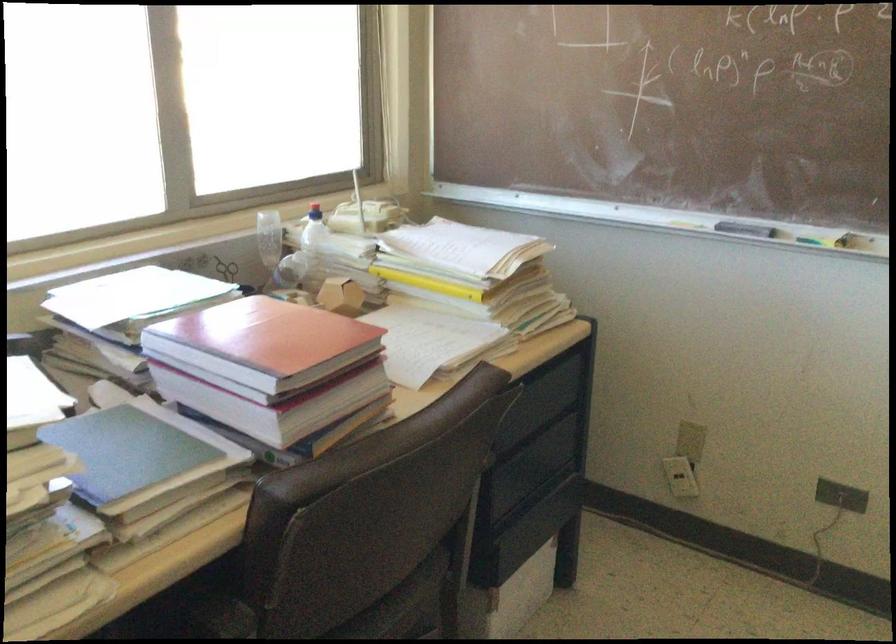
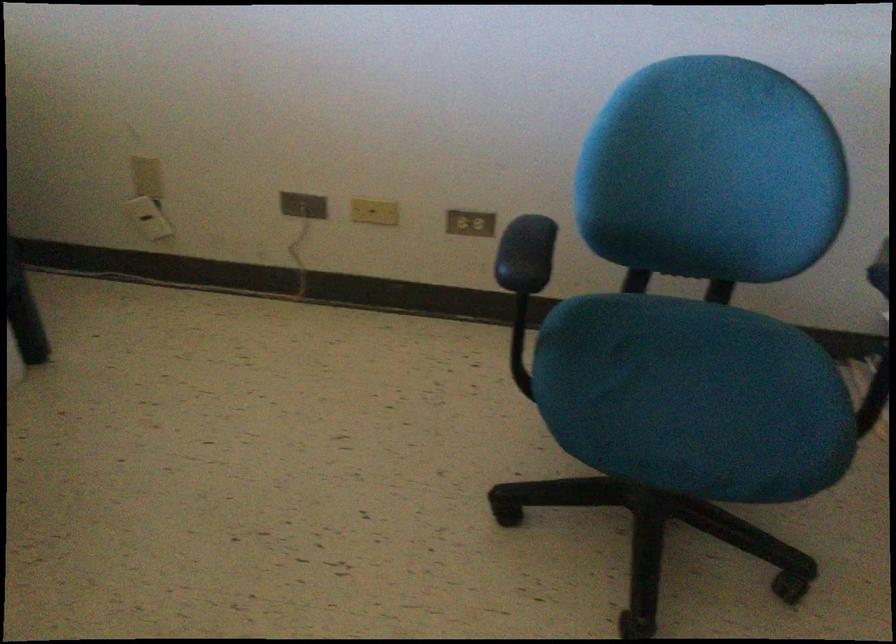
The images are taken continuously from a first-person perspective. In which direction is your viewpoint rotating?

The camera's rotation is toward right-down.